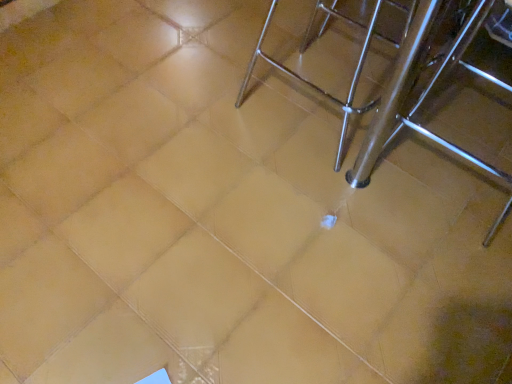
You are a GUI agent. You are given a task and a screenshot of the screen. Output one action in this format:
    pyautogui.click(x=<x>, y=<y>)
    Task: Click on the free space to the left of polished metal chair at upper right
    This screenshot has height=384, width=512.
    Given the screenshot: What is the action you would take?
    pyautogui.click(x=208, y=107)